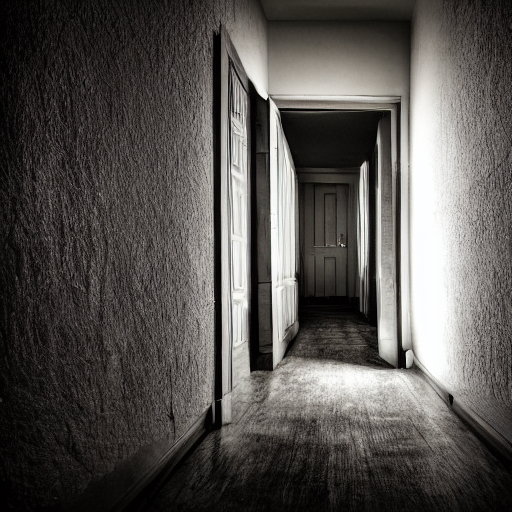
Find the location of a particular element. The width and height of the screenshot is (512, 512). handle is located at coordinates (342, 241).